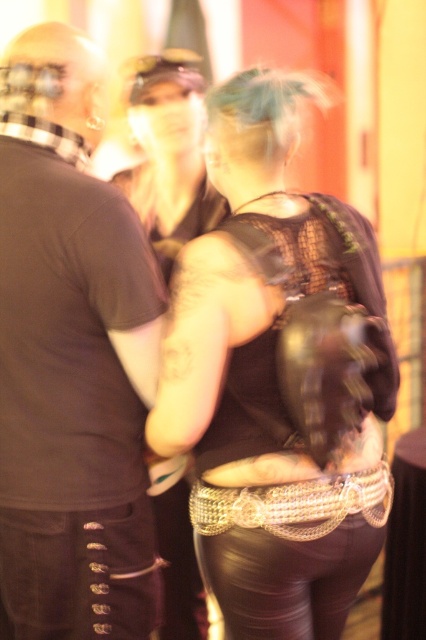
Based on the scene description, can you identify the object located at point coordinates (71, 358)?

The object at point coordinates (71, 358) is the matte black shirt at left.